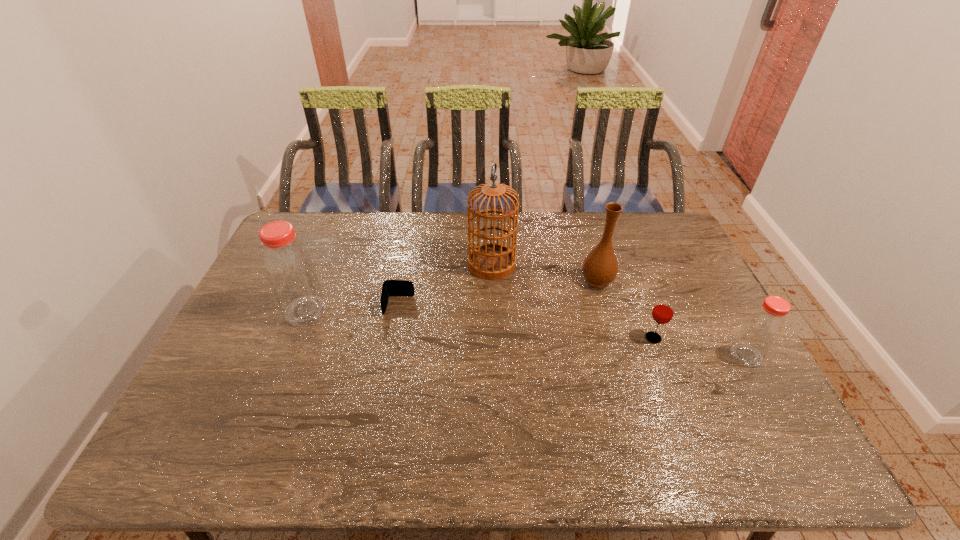
Find the location of `blank space that satisfies the following two spatial constraints: 1. on the back side of the leftmost object; 2. on the left side of the tallest object`. blank space that satisfies the following two spatial constraints: 1. on the back side of the leftmost object; 2. on the left side of the tallest object is located at coordinates (324, 264).

I want to click on free space that satisfies the following two spatial constraints: 1. on the front side of the shorter bottle; 2. on the left side of the second object from right to left, so click(660, 355).